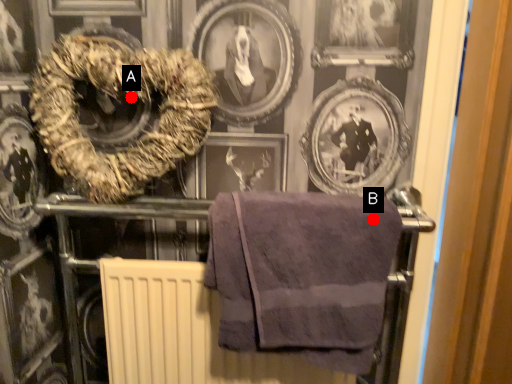
Question: Two points are circled on the image, labeled by A and B beside each circle. Which of the following is the farthest from the observer?

Choices:
 (A) A is further
 (B) B is further

Answer: (A)